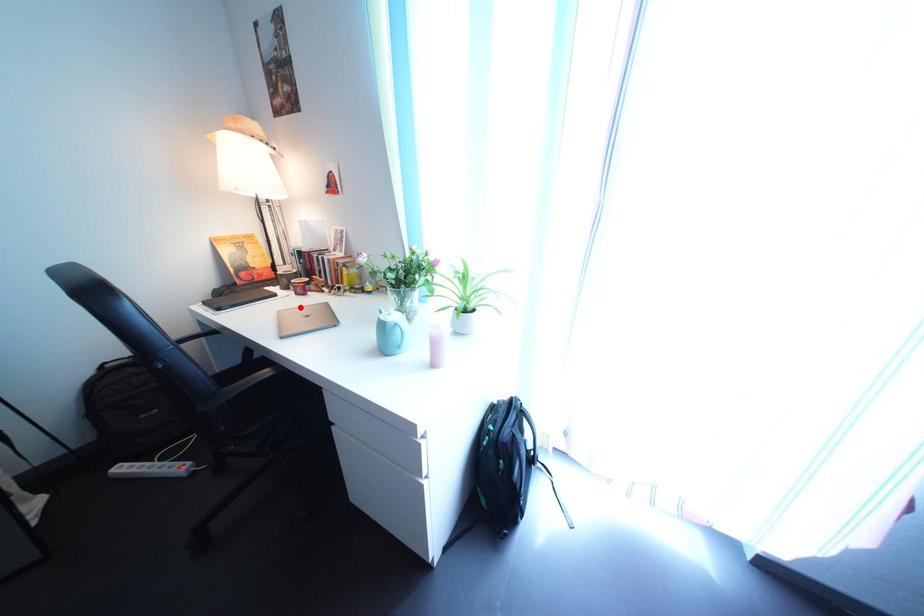
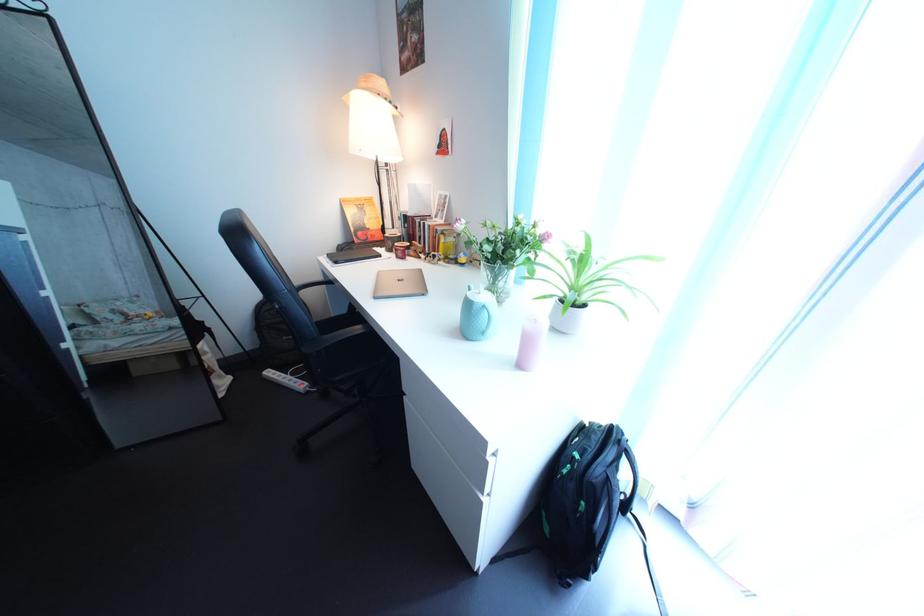
The point at the highlighted location is marked in the first image. Where is the corresponding point in the second image?

(402, 269)